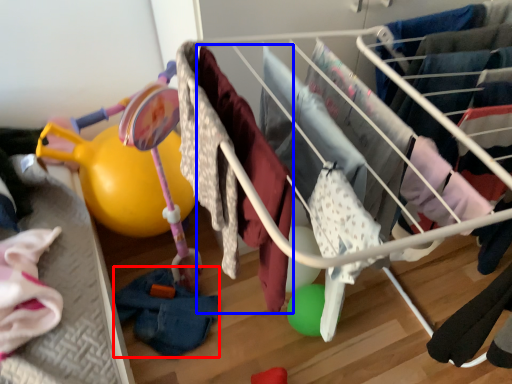
Question: Which of the following is the farthest to the observer, clothing (highlighted by a red box) or clothing (highlighted by a blue box)?

Choices:
 (A) clothing
 (B) clothing

Answer: (A)